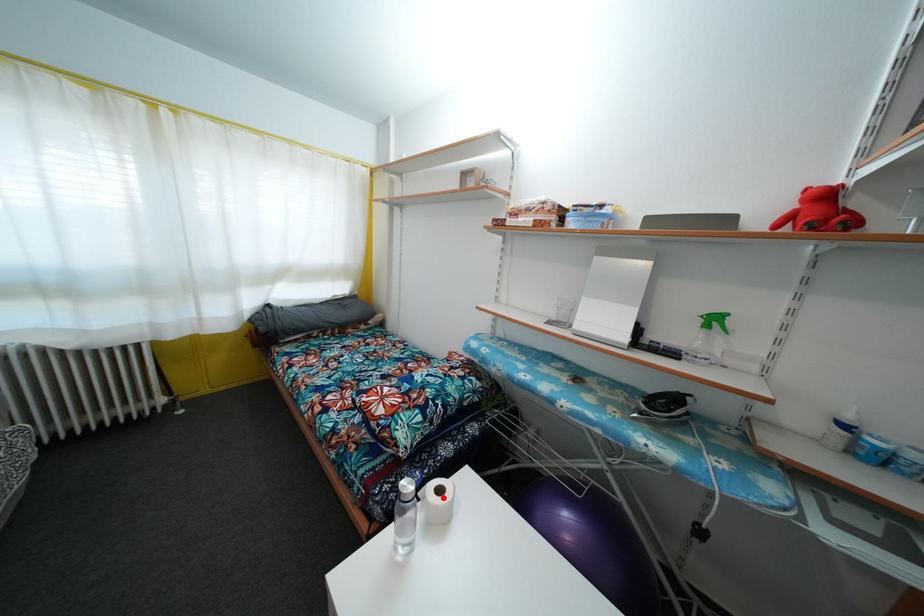
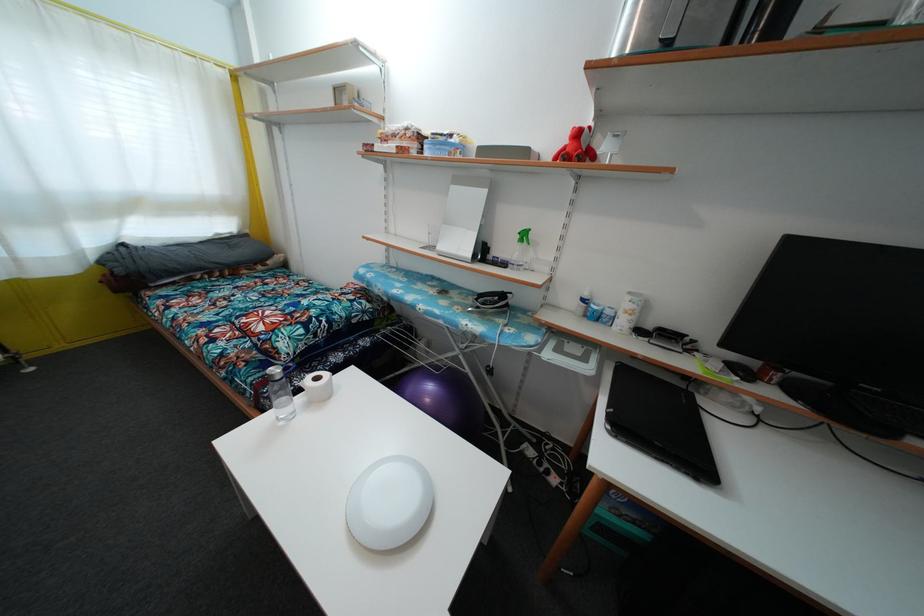
In the second image, find the point that corresponds to the highlighted location in the first image.

(321, 386)